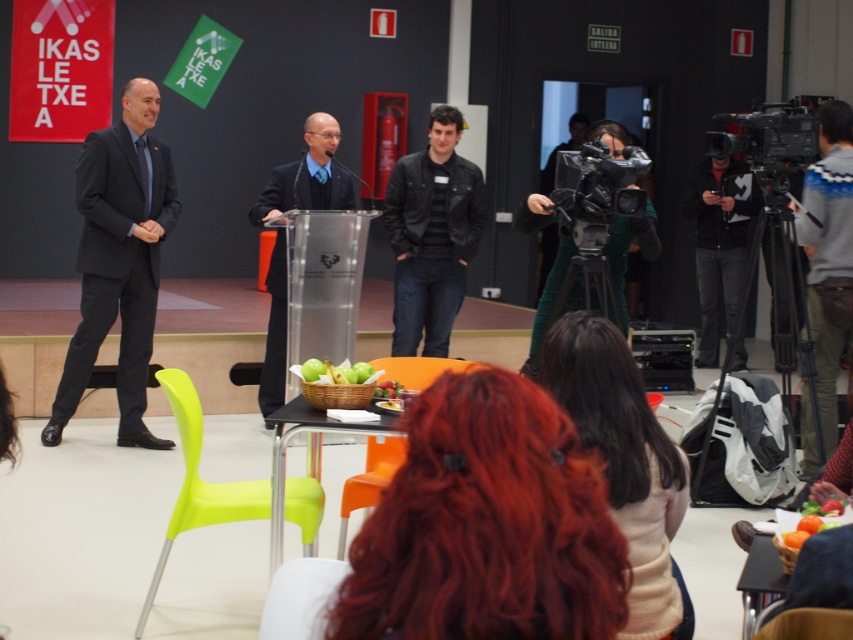
You are standing at the back of the hall and want to take a photo of both the point at coordinates point (177,500) and point (320,602) in the image. Which point should you focus on first to ensure both are in focus?

You should focus on point (177,500) first because it is closer to the camera than point (320,602). This ensures the closer point is in focus, and the farther point will also be in focus due to depth of field.

You are sitting in the orange plastic chair at center and want to see the matte black suit at left. Can you see it without moving your head?

The matte black suit at left is located above the orange plastic chair at center, so you can see it without moving your head as long as you look upward.

You are attending the event and need to choose between the green plastic chair at lower left and the green plastic chair at lower center for seating. Which chair offers more legroom based on their sizes?

The green plastic chair at lower left has a larger width than the green plastic chair at lower center, so it likely offers more legroom.